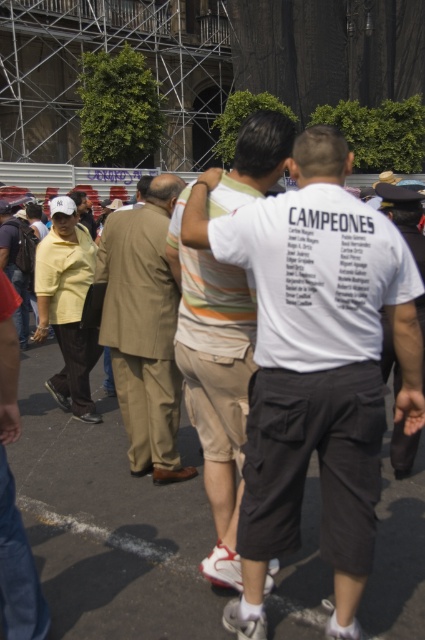
You are holding a camera and want to take a photo of the point at coordinates (206, 234). If you are standing 3.01 meters away from the point, will you be able to capture it in your shot without moving closer?

Yes, since the distance between you and the point is exactly 3.01 meters, which matches the required distance, so the point at coordinates (206, 234) will be in your shot.